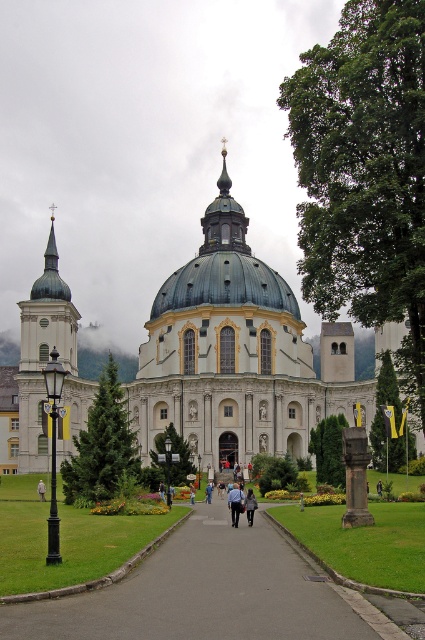
Between smooth asphalt path at center and light blue shirt at center, which one is positioned higher?

Positioned higher is light blue shirt at center.

Is smooth asphalt path at center wider than light blue shirt at center?

Indeed, smooth asphalt path at center has a greater width compared to light blue shirt at center.

Is point (235, 531) in front of point (232, 490)?

That is True.

The height and width of the screenshot is (640, 425). Find the location of `smooth asphalt path at center`. smooth asphalt path at center is located at coordinates (209, 593).

Who is more forward, [204,264] or [240,500]?

Positioned in front is point [240,500].

Can you confirm if white marble church at center is bigger than light blue shirt at center?

Yes.

Which is in front, point (172, 360) or point (235, 516)?

Point (235, 516) is in front.

Find the location of a particular element. This screenshot has width=425, height=640. white marble church at center is located at coordinates (237, 353).

Who is lower down, white marble church at center or blue denim jacket at center?

blue denim jacket at center is lower down.

Is white marble church at center shorter than blue denim jacket at center?

In fact, white marble church at center may be taller than blue denim jacket at center.

At what (x,y) coordinates should I click in order to perform the action: click on white marble church at center. Please return your answer as a coordinate pair (x, y). The height and width of the screenshot is (640, 425). Looking at the image, I should click on (237, 353).